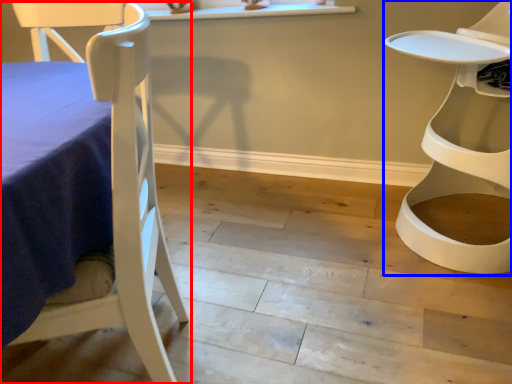
Question: Which object is further to the camera taking this photo, chair (highlighted by a red box) or chair (highlighted by a blue box)?

Choices:
 (A) chair
 (B) chair

Answer: (B)